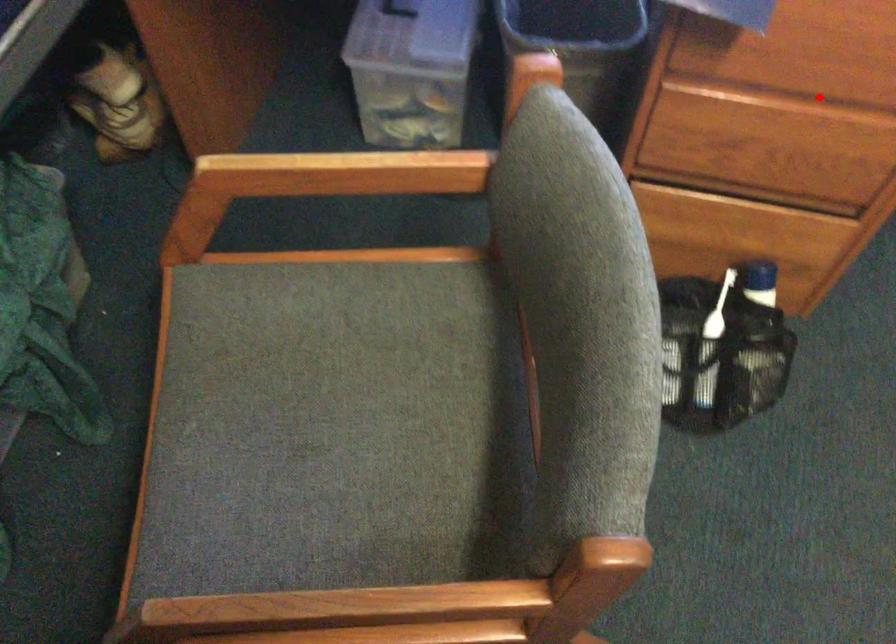
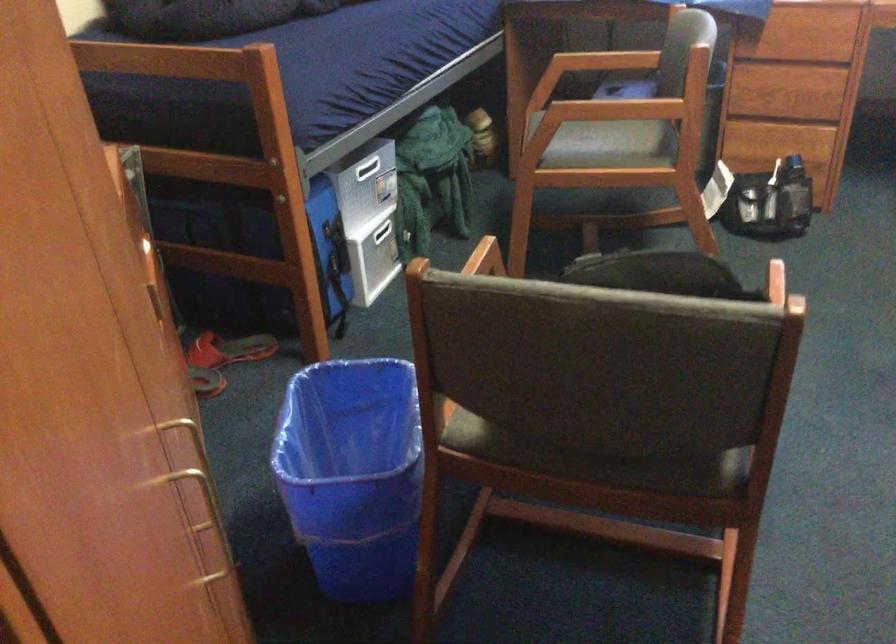
Where in the second image is the point corresponding to the highlighted location from the first image?

(803, 46)